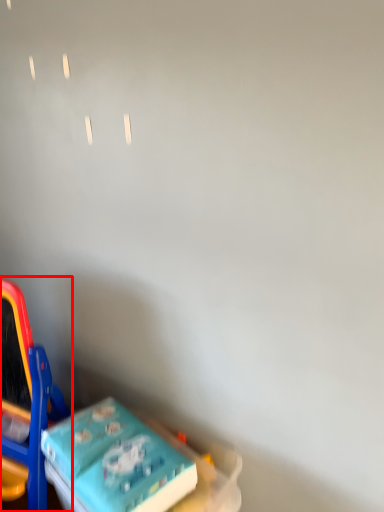
Question: From the image's perspective, what is the correct spatial positioning of toy (annotated by the red box) in reference to toy?

Choices:
 (A) above
 (B) below

Answer: (A)